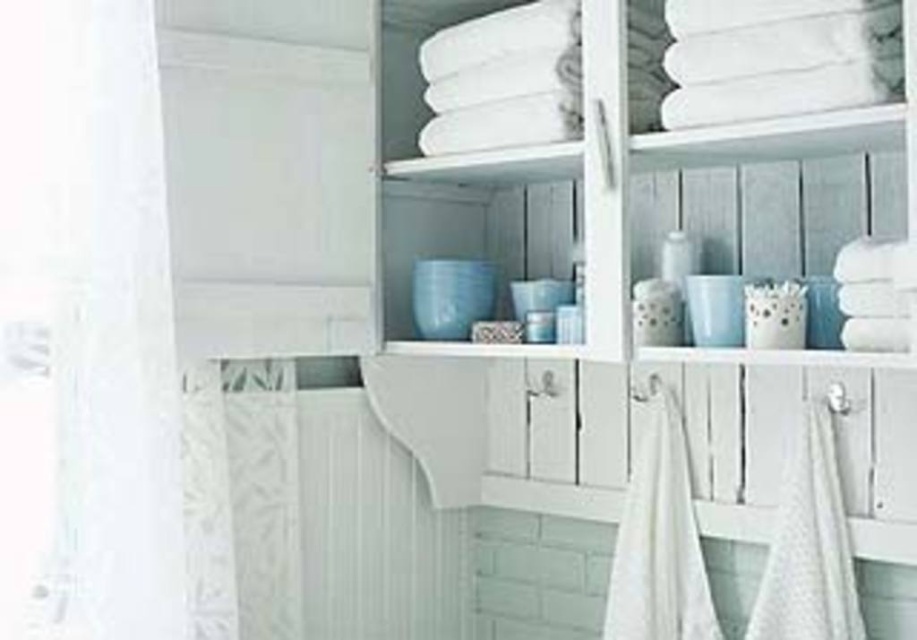
You are trying to hang a small picture frame that is 15 cm tall on the bathroom wall. You have two towels to choose from as reference points for placement. The white cotton towel at center and the white textured towel at lower right. Which towel should you use to ensure the frame is placed above an item taller than the frame?

The white cotton towel at center is taller than the white textured towel at lower right. Therefore, you should place the frame above the white cotton towel at center since it is taller than the 15 cm frame.

You are arranging a bathroom display and need to know which item has a greater width between the white sheer curtain at left and the white textured towel at lower right. Based on the scene, can you determine which one is wider?

The white sheer curtain at left is wider than the white textured towel at lower right according to the description.

You are standing in the bathroom and want to hang a new curtain rod. The current white sheer curtain at left is located at point (97,332). If you want to place the new curtain rod 20 cm to the right of the existing curtain, where should the new curtain rod be positioned?

The new curtain rod should be placed 20 cm to the right of the existing white sheer curtain at left, which is currently at point (97,332).